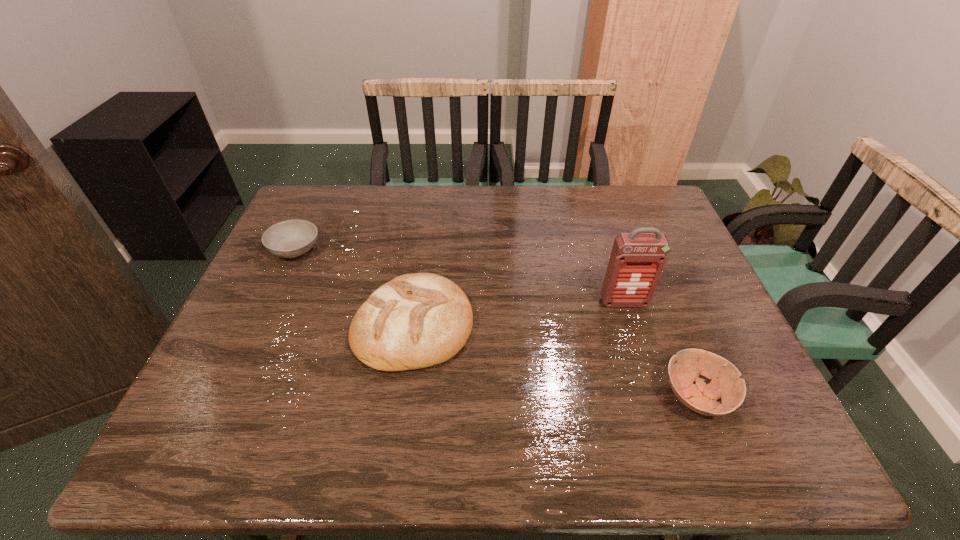
Locate an element on the screen. free location at the near right corner of the desktop is located at coordinates (765, 430).

Where is `free point between the third shortest object and the leftmost object`? This screenshot has width=960, height=540. free point between the third shortest object and the leftmost object is located at coordinates (354, 287).

Where is `unoccupied position between the third shortest object and the tallest object`? This screenshot has width=960, height=540. unoccupied position between the third shortest object and the tallest object is located at coordinates 518,313.

Where is `vacant area between the right bowl and the left bowl`? The width and height of the screenshot is (960, 540). vacant area between the right bowl and the left bowl is located at coordinates (495, 323).

Find the location of a particular element. Image resolution: width=960 pixels, height=540 pixels. blank region between the left bowl and the right bowl is located at coordinates (495, 323).

This screenshot has height=540, width=960. I want to click on vacant space in between the tallest object and the right bowl, so click(x=660, y=349).

At what (x,y) coordinates should I click in order to perform the action: click on free space between the second object from left to right and the left bowl. Please return your answer as a coordinate pair (x, y). The width and height of the screenshot is (960, 540). Looking at the image, I should click on (354, 287).

Locate an element on the screen. Image resolution: width=960 pixels, height=540 pixels. unoccupied area between the leftmost object and the third object from right to left is located at coordinates (354, 287).

This screenshot has width=960, height=540. In order to click on free space between the nearer bowl and the farthest object in this screenshot , I will do `click(495, 323)`.

In order to click on vacant space in between the first-aid kit and the left bowl in this screenshot , I will do `click(460, 276)`.